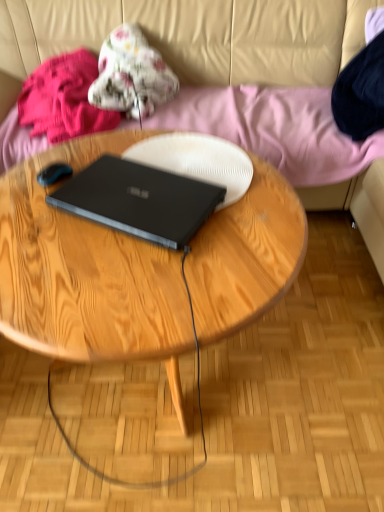
This screenshot has width=384, height=512. What are the coordinates of `vacant region to the left of black matte laptop at center` in the screenshot? It's located at (34, 207).